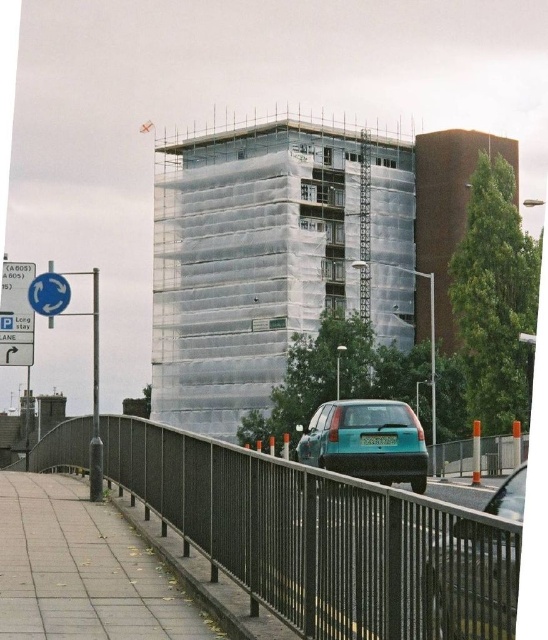
You are standing on the pedestrian bridge and want to take a photo of the construction site. There are two points marked on your map at coordinates point [275,212] and point [452,589]. Which point should you stand at to ensure the blue car is not blocking your view of the building?

You should stand at point [452,589] because point [275,212] is behind it, meaning the blue car might block the view from the latter point.

You are a delivery driver approaching the construction site. You need to park your teal matte hatchback at center near the black metal fence at lower center. Given that your vehicle is smaller than the fence, will it fit in the available space between them?

The black metal fence at lower center is larger than the teal matte hatchback at center. Since the fence is bigger, there should be enough space for the hatchback to park nearby without any issue.

You are a delivery driver approaching the construction site. You see the teal matte car at center and the blue plastic sign at upper left. According to the scene, which object is located to the right of the other?

The teal matte car at center is positioned on the right side of blue plastic sign at upper left.